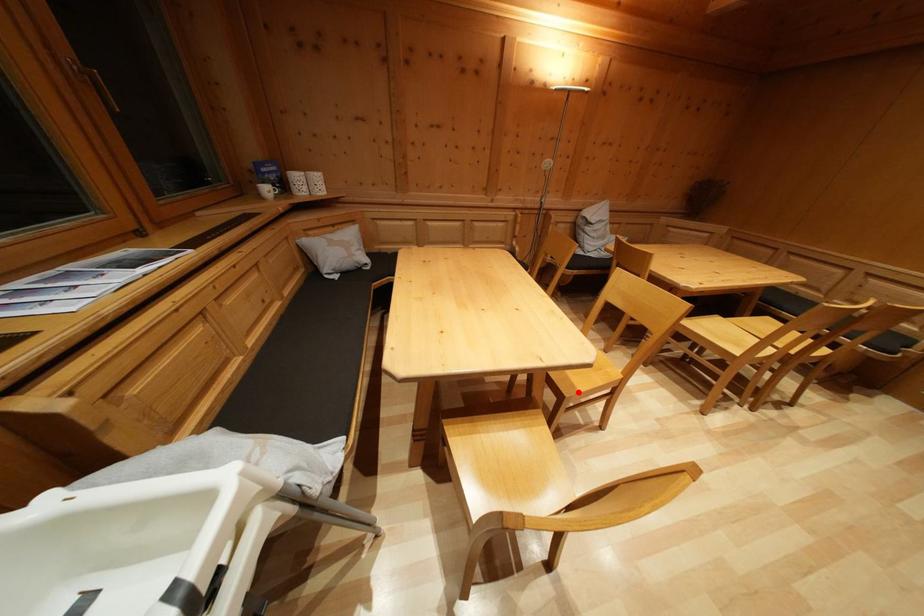
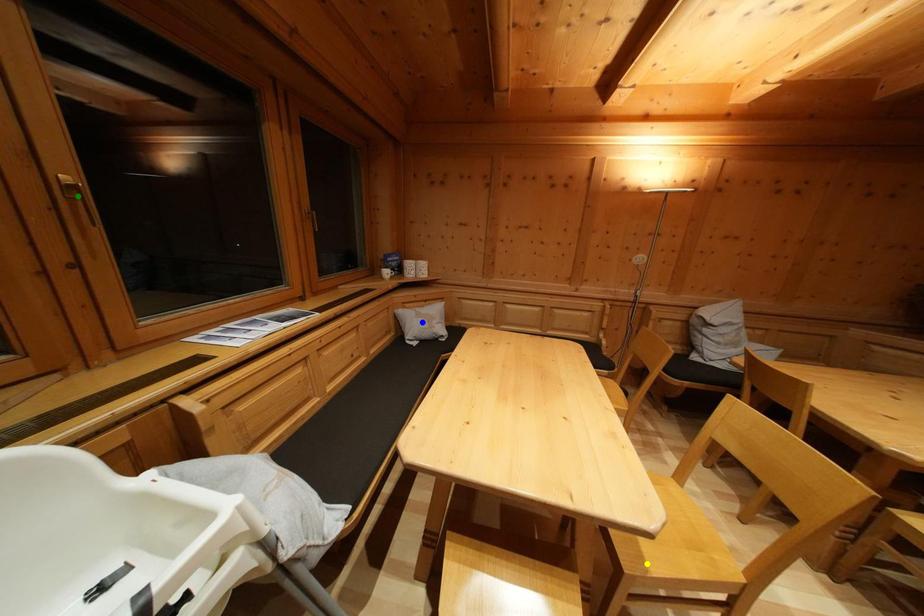
Question: I am providing you with two images of the same scene from different viewpoints. A red point is marked on the first image. You are given multiple points on the second image. Which mark in image 2 goes with the point in image 1?

Choices:
 (A) yellow point
 (B) blue point
 (C) green point

Answer: (A)